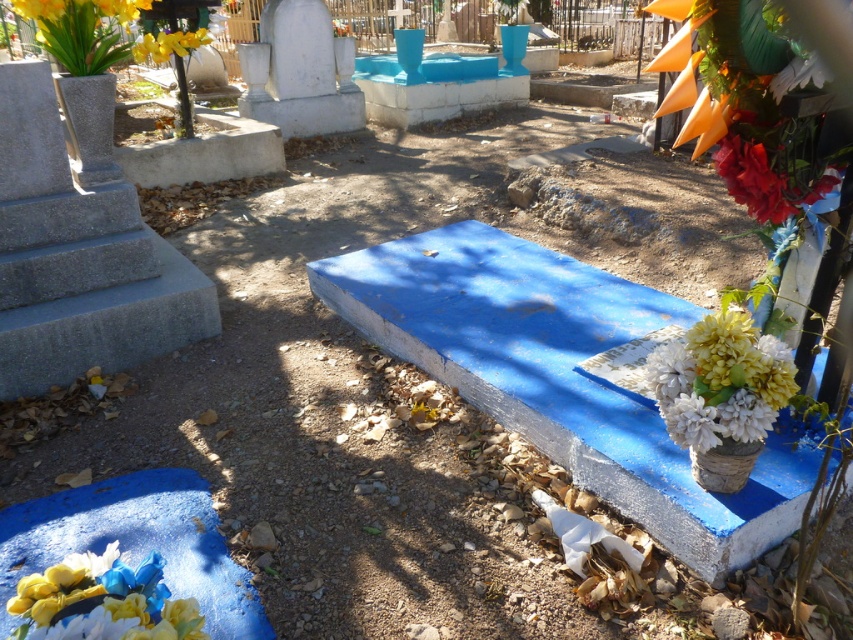
Between white matte flowers at center right and red matte flower at upper right, which one has less height?

Standing shorter between the two is red matte flower at upper right.

Does white matte flowers at center right lie in front of red matte flower at upper right?

Yes, white matte flowers at center right is in front of red matte flower at upper right.

Describe the element at coordinates (720, 381) in the screenshot. I see `white matte flowers at center right` at that location.

Find the location of a particular element. The height and width of the screenshot is (640, 853). white matte flowers at center right is located at coordinates pos(720,381).

Between white matte flowers at center right and matte floral bouquet at lower left, which one has less height?

matte floral bouquet at lower left is shorter.

Is white matte flowers at center right smaller than matte floral bouquet at lower left?

No.

Looking at this image, who is more forward, [693,392] or [132,593]?

Point [132,593] is in front.

Where is `white matte flowers at center right`? Image resolution: width=853 pixels, height=640 pixels. white matte flowers at center right is located at coordinates (720, 381).

Does white matte flowers at center right have a greater height compared to yellow matte flowers at upper left?

Incorrect, white matte flowers at center right's height is not larger of yellow matte flowers at upper left's.

Can you confirm if white matte flowers at center right is smaller than yellow matte flowers at upper left?

Yes.

Locate an element on the screen. white matte flowers at center right is located at coordinates (720, 381).